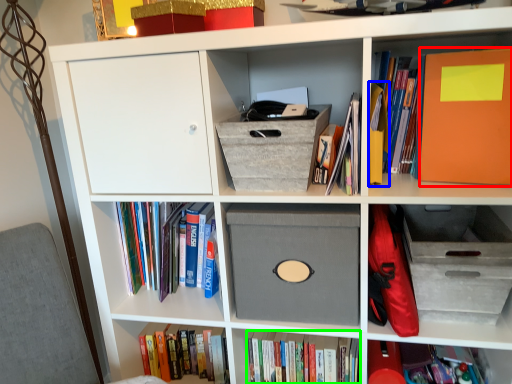
Question: Considering the real-world distances, which object is closest to paperback book (highlighted by a red box)? paperback book (highlighted by a blue box) or book (highlighted by a green box).

Choices:
 (A) paperback book
 (B) book

Answer: (A)